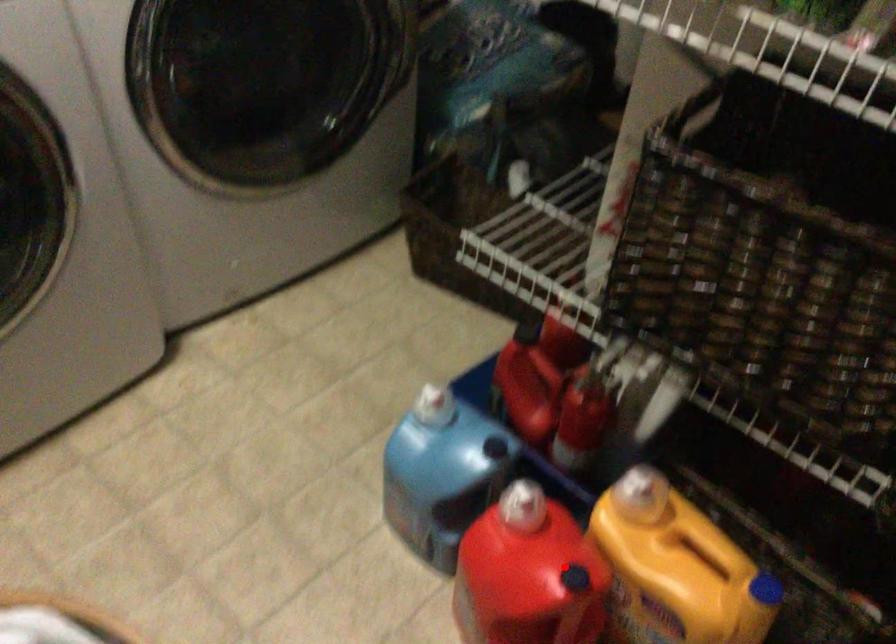
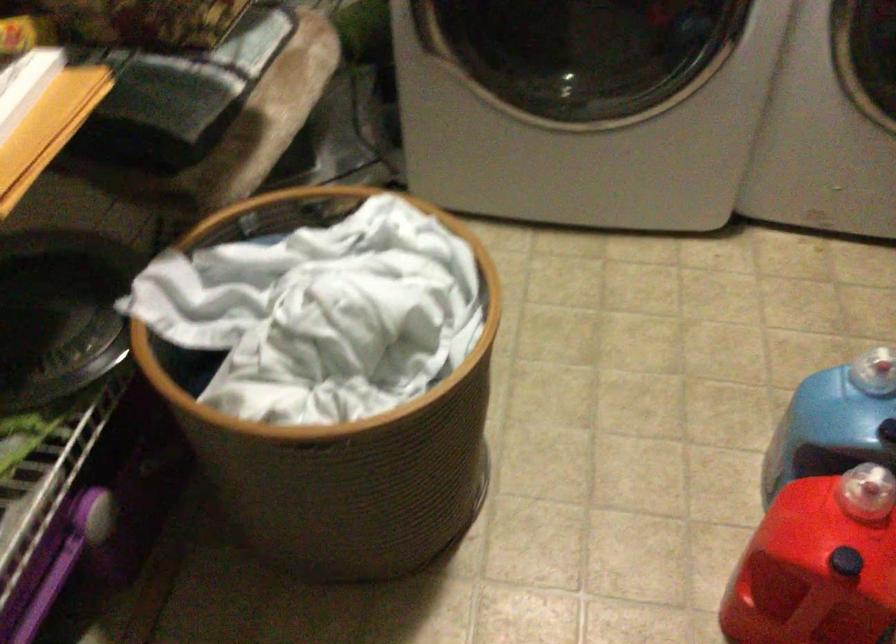
Question: I am providing you with two images of the same scene from different viewpoints. In image1, a red point is highlighted. Considering the same 3D point in image2, which of the following is correct?

Choices:
 (A) It is closer
 (B) It is farther

Answer: (A)